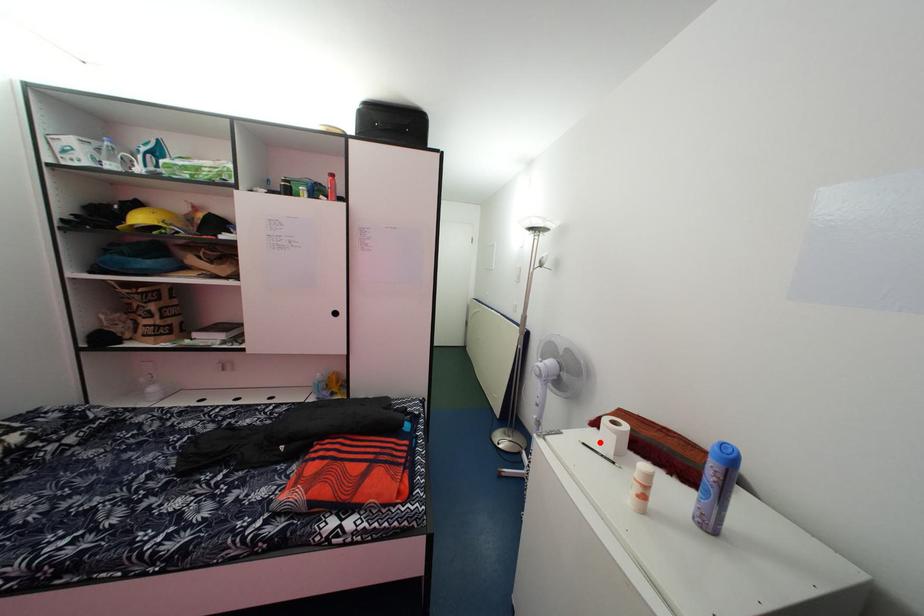
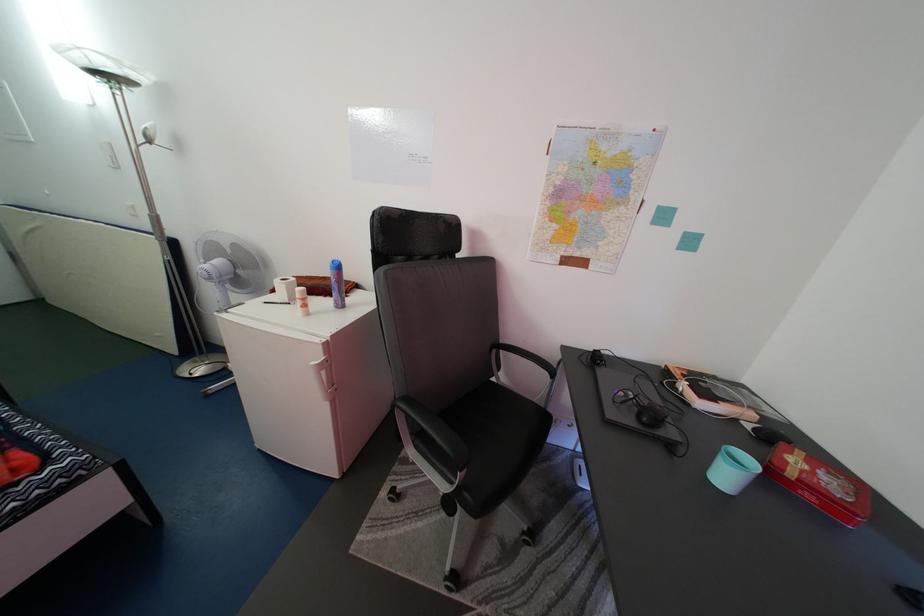
Question: A red point is marked in image1. In image2, is the corresponding 3D point closer to the camera or farther? Reply with the corresponding letter.

Choices:
 (A) The corresponding 3D point is closer.
 (B) The corresponding 3D point is farther.

Answer: (B)